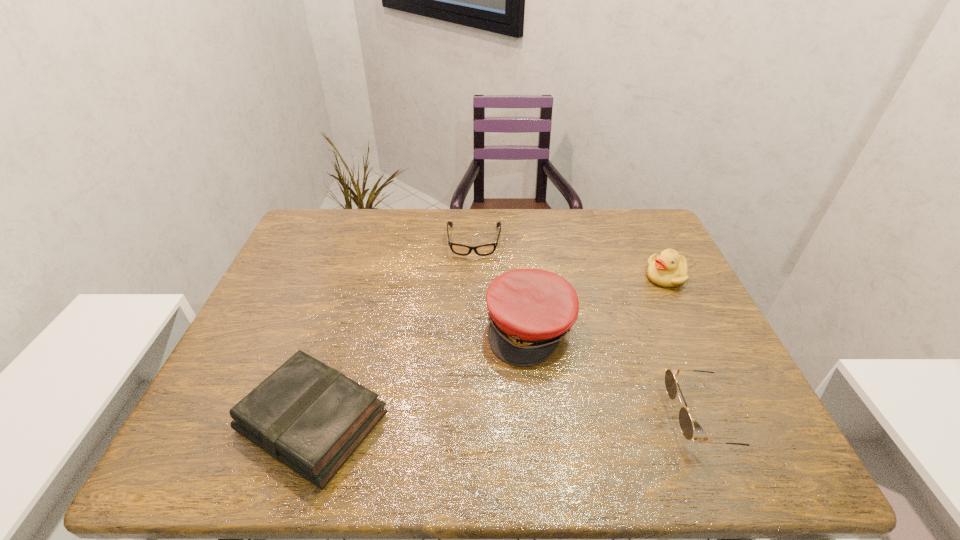
Where is `free space on the desktop that is between the second shortest object and the sunglasses and is positioned on the front-facing side of the shortest object`? The height and width of the screenshot is (540, 960). free space on the desktop that is between the second shortest object and the sunglasses and is positioned on the front-facing side of the shortest object is located at coordinates (466, 420).

Find the location of `free space on the desktop that is between the second shortest object and the sunglasses and is positioned on the front of the tallest object with an emblem`. free space on the desktop that is between the second shortest object and the sunglasses and is positioned on the front of the tallest object with an emblem is located at coordinates (529, 420).

Identify the location of vacant spot on the desktop that is between the fourth tallest object and the sunglasses and is positioned on the front-facing side of the duckling. (566, 419).